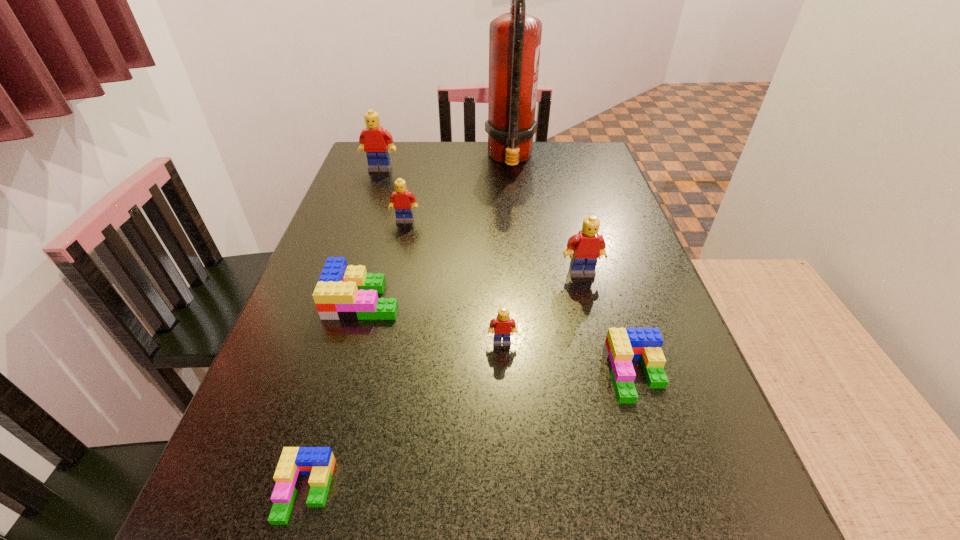
Identify which green Lego is the second nearest to the tallest object. Please provide its 2D coordinates. Your answer should be formatted as a tuple, i.e. [(x, y)], where the tuple contains the x and y coordinates of a point satisfying the conditions above.

[(622, 345)]

The width and height of the screenshot is (960, 540). Find the location of `free spot that satisfies the following two spatial constraints: 1. on the front-facing side of the second shortest Lego; 2. on the left side of the farthest Lego`. free spot that satisfies the following two spatial constraints: 1. on the front-facing side of the second shortest Lego; 2. on the left side of the farthest Lego is located at coordinates point(309,374).